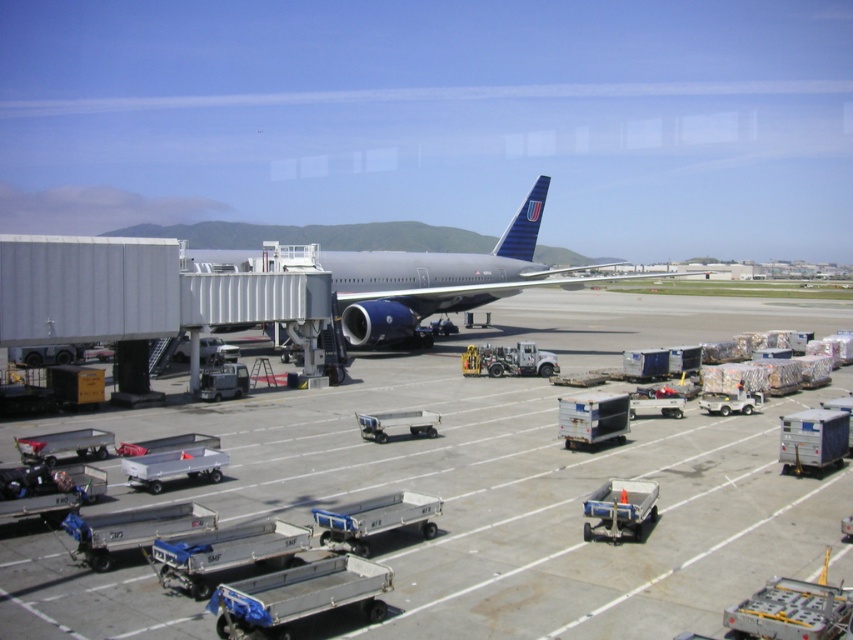
Consider the image. You are standing at the point marked as point (531, 476) in the airport tarmac scene. What is the color of the surface you are currently standing on?

The metallic gray tarmac at center is located at point (531, 476), so the surface you are standing on is metallic gray.

Consider the image. You are a maintenance worker who needs to inspect the distance between the metallic gray tarmac at center and the metallic gray airplane at center. According to the airport safety guidelines, the minimum safe distance between such objects should be 10 meters. Is the current distance compliant with the guidelines?

The metallic gray tarmac at center is 9.56 meters from the metallic gray airplane at center. Since the minimum safe distance required is 10 meters, the current distance of 9.56 meters is below the required threshold, making it noncompliant with the airport safety guidelines.

Based on the scene description, where is the metallic gray tarmac at center located in terms of coordinates?

The metallic gray tarmac at center is located at coordinates point (531, 476).